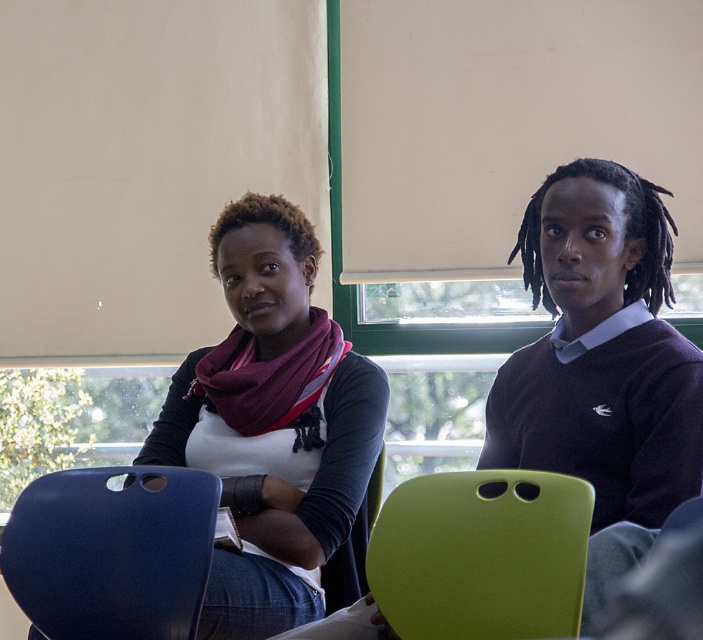
You are a person who needs to choose between the green matte chair at center and the matte blue chair at lower left for a meeting. Which chair would give you more seating space?

The matte blue chair at lower left is larger than the green matte chair at center, so it provides more seating space.

You are a photographer positioned behind the matte black sweater at center and the matte blue chair at lower left. Which object is closer to you?

The matte black sweater at center is closer to you because it is positioned further to the viewer than the matte blue chair at lower left.

Based on the photo, you are standing in a classroom and want to reach a point that is exactly at coordinates point (340,525). If you are currently 10 feet away from this point, how much closer do you need to get to be right at the point?

The distance of point (340,525) from viewer is 7.65 feet. To reach the point from your current position 10 feet away, you need to move 2.35 feet closer.